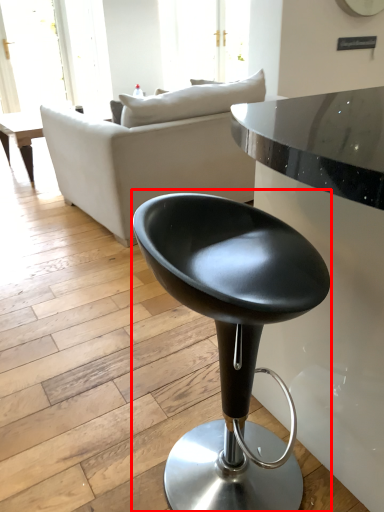
Question: Where is chair (annotated by the red box) located in relation to studio couch in the image?

Choices:
 (A) right
 (B) left

Answer: (A)